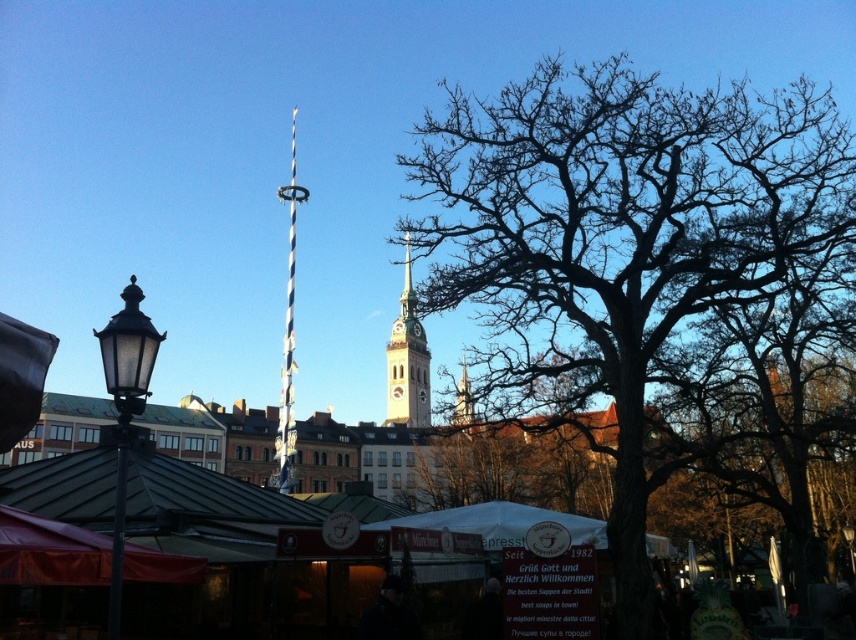
Looking at this image, is bare wood tree at center in front of red fabric canopy at lower left?

No, it is not.

Locate an element on the screen. bare wood tree at center is located at coordinates 619,244.

Is point (116, 342) positioned before point (290, 289)?

Yes, it is in front of point (290, 289).

Can you confirm if matte black lamp post at left is taller than blue and white striped pole at center?

Incorrect, matte black lamp post at left's height is not larger of blue and white striped pole at center's.

Is point (107, 625) positioned behind point (293, 307)?

No, it is not.

At what (x,y) coordinates should I click in order to perform the action: click on matte black lamp post at left. Please return your answer as a coordinate pair (x, y). Looking at the image, I should click on (125, 412).

Who is positioned more to the right, bare wood tree at center or blue and white striped pole at center?

bare wood tree at center is more to the right.

Is point (510, 388) more distant than point (292, 241)?

No, it is in front of (292, 241).

Identify the location of bare wood tree at center. (619, 244).